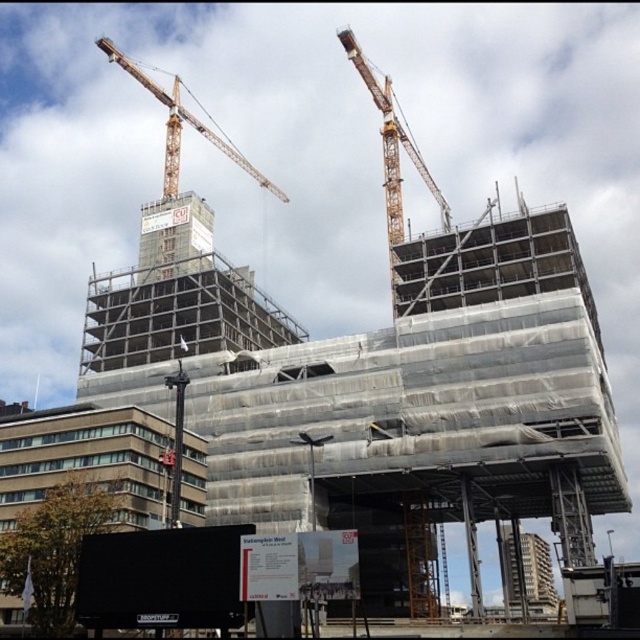
From the picture: Does yellow metallic crane at upper center have a greater width compared to orange metallic crane at upper left?

No, yellow metallic crane at upper center is not wider than orange metallic crane at upper left.

Is yellow metallic crane at upper center smaller than orange metallic crane at upper left?

A: Yes.

Is point (442, 195) positioned after point (173, 186)?

Yes, it is behind point (173, 186).

I want to click on yellow metallic crane at upper center, so click(x=392, y=156).